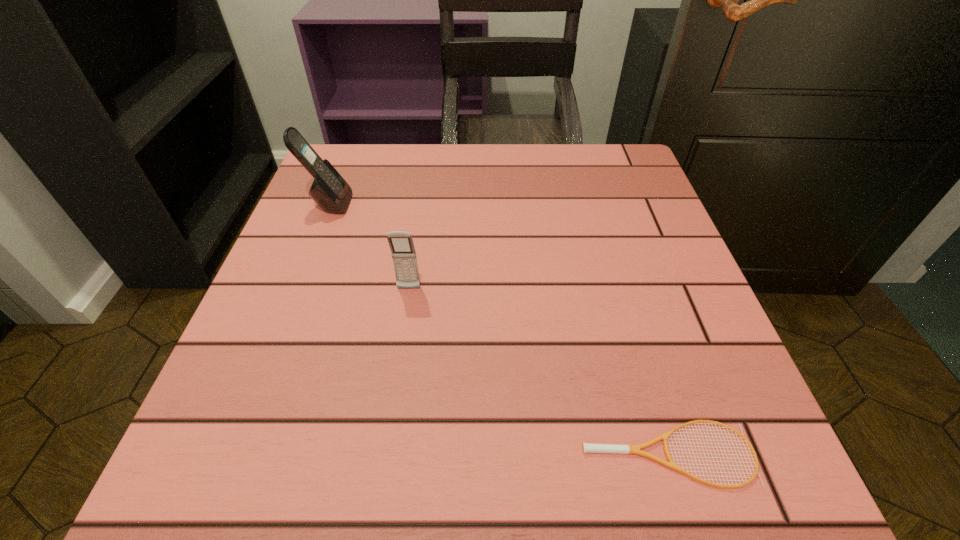
In order to click on vacant space that satisfies the following two spatial constraints: 1. on the front-facing side of the nearest object; 2. on the right side of the second shortest object in this screenshot , I will do coord(384,454).